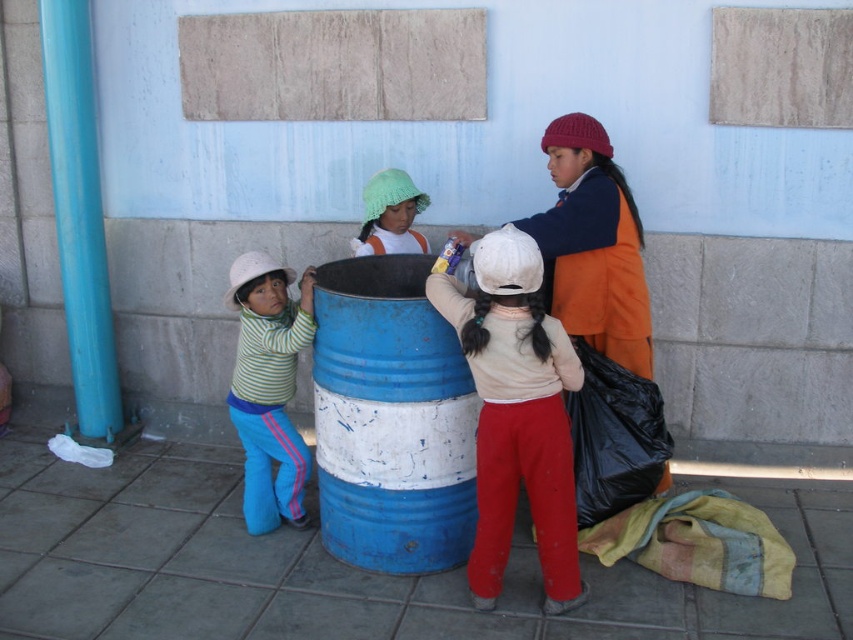
Question: Does blue painted metal barrel at center appear under matte white hat at center?

Choices:
 (A) no
 (B) yes

Answer: (B)

Question: Which point is closer to the camera taking this photo?

Choices:
 (A) (386, 240)
 (B) (282, 448)
 (C) (335, 531)

Answer: (C)

Question: Does matte white hat at center have a greater width compared to knitted green hat at center?

Choices:
 (A) no
 (B) yes

Answer: (B)

Question: Can you confirm if matte white hat at center is positioned to the left of striped cotton shirt at left?

Choices:
 (A) no
 (B) yes

Answer: (A)

Question: Which point is closer to the camera?

Choices:
 (A) blue painted metal barrel at center
 (B) matte white hat at center

Answer: (B)

Question: Which object is the closest to the matte white hat at center?

Choices:
 (A) blue painted metal barrel at center
 (B) knitted green hat at center

Answer: (A)